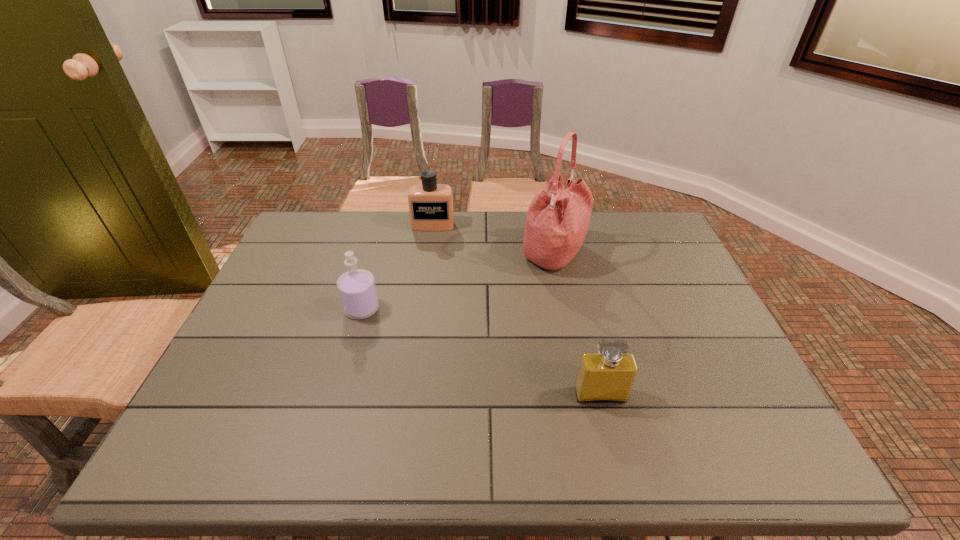
Where is `free space located on the back of the second nearest perfume`? free space located on the back of the second nearest perfume is located at coordinates (379, 249).

I want to click on blank space located on the front-facing side of the nearest object, so click(616, 462).

Image resolution: width=960 pixels, height=540 pixels. What are the coordinates of `handbag located at the far edge` in the screenshot? It's located at (557, 221).

You are a GUI agent. You are given a task and a screenshot of the screen. Output one action in this format:
    pyautogui.click(x=<x>, y=<y>)
    Task: Click on the perfume at the far edge
    
    Given the screenshot: What is the action you would take?
    pyautogui.click(x=430, y=204)

This screenshot has width=960, height=540. I want to click on blank space at the far edge, so click(x=372, y=226).

The image size is (960, 540). In the image, there is a desktop. What are the coordinates of `vacant space at the near edge` in the screenshot? It's located at (630, 448).

You are a GUI agent. You are given a task and a screenshot of the screen. Output one action in this format:
    pyautogui.click(x=<x>, y=<y>)
    Task: Click on the free space at the left edge
    
    Given the screenshot: What is the action you would take?
    pyautogui.click(x=254, y=350)

Where is `free spot at the right edge of the desktop`? The width and height of the screenshot is (960, 540). free spot at the right edge of the desktop is located at coordinates (632, 254).

Where is `vacant space at the far left corner of the desktop`? vacant space at the far left corner of the desktop is located at coordinates (332, 216).

Image resolution: width=960 pixels, height=540 pixels. Identify the location of free space at the far right corner of the desktop. (665, 241).